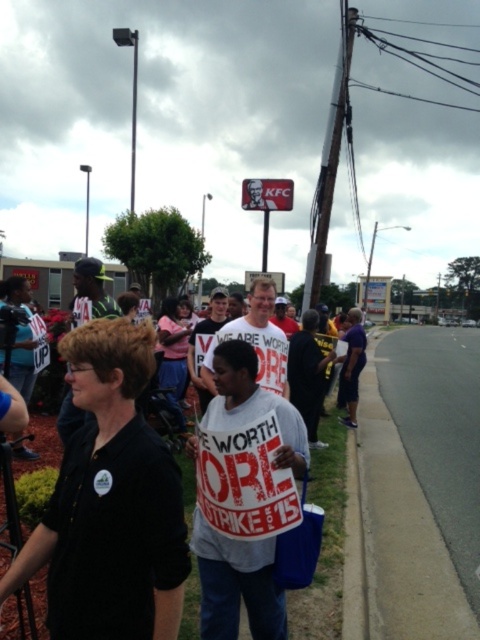
You are a photographer trying to capture a clear shot of both the white paper sign at center and the white cotton shirt at center. Given that your camera has a limited field of view, which object should you focus on to ensure both are visible without zooming in too much?

Since the white paper sign at center is wider than the white cotton shirt at center, focusing on the sign will allow both objects to fit within the frame without excessive zooming.

You are standing at the point labeled point (437,349). You want to throw a leaflet to a protester who is 27.44 meters away from you. Can you estimate whether the leaflet will reach them if you throw it with an average strength?

The distance between you and the protester at point (437,349) is 27.44 meters. An average throw can typically reach up to around 20 meters, so it is unlikely the leaflet will reach them with an average strength throw.

You are a drone operator trying to capture an aerial view of the protest scene. The drone is currently at a position above the gray asphalt pavement at lower right. To ensure the entire protest area is visible in the image, should you adjust the drone to move north or south? Please explain your reasoning based on the pavement location.

The gray asphalt pavement at lower right is located at point (421, 484). Since this coordinate places the pavement near the lower right corner of the image, adjusting the drone to move north would position it higher and provide a broader view of the protest area, ensuring the entire scene is captured.